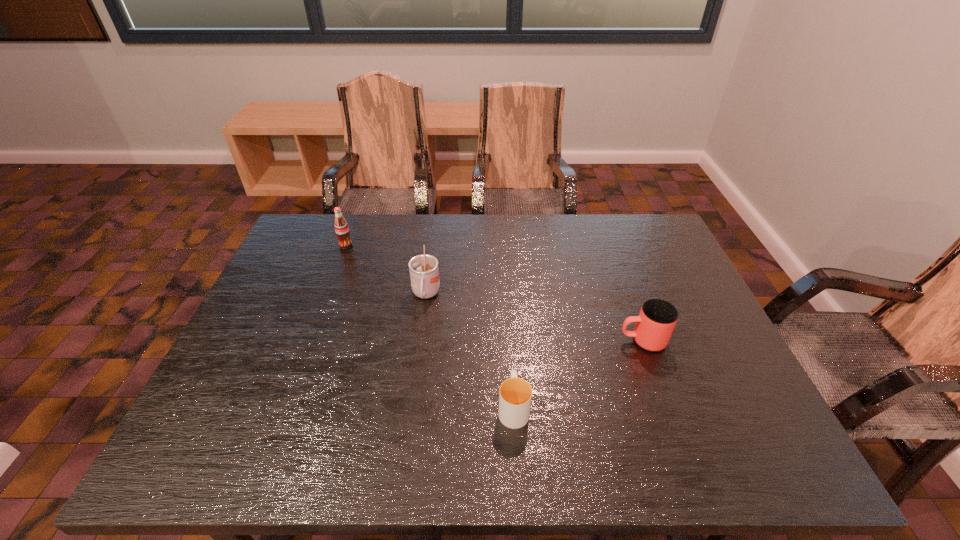
Identify the location of free spot that satisfies the following two spatial constraints: 1. with the handle on the side of the nearest cup; 2. on the handle side of the second shortest cup. This screenshot has height=540, width=960. (509, 341).

Identify the location of vacant space that satisfies the following two spatial constraints: 1. with the handle on the side of the nearest object; 2. on the handle side of the second shortest object. The image size is (960, 540). (509, 341).

You are a GUI agent. You are given a task and a screenshot of the screen. Output one action in this format:
    pyautogui.click(x=<x>, y=<y>)
    Task: Click on the blank space that satisfies the following two spatial constraints: 1. on the side with the handle of the leftmost cup; 2. on the handle side of the second nearest cup
    
    Given the screenshot: What is the action you would take?
    pyautogui.click(x=420, y=341)

Find the location of a particular element. Image resolution: width=960 pixels, height=540 pixels. vacant region that satisfies the following two spatial constraints: 1. on the handle side of the rightmost object; 2. on the side with the handle of the third object from right to left is located at coordinates (626, 295).

Where is `vacant area that satisfies the following two spatial constraints: 1. with the handle on the side of the nearest object; 2. on the handle side of the second farthest cup`? This screenshot has width=960, height=540. vacant area that satisfies the following two spatial constraints: 1. with the handle on the side of the nearest object; 2. on the handle side of the second farthest cup is located at coordinates (509, 341).

Locate an element on the screen. This screenshot has height=540, width=960. blank space that satisfies the following two spatial constraints: 1. on the side with the handle of the farthest cup; 2. on the handle side of the rightmost cup is located at coordinates tap(420, 341).